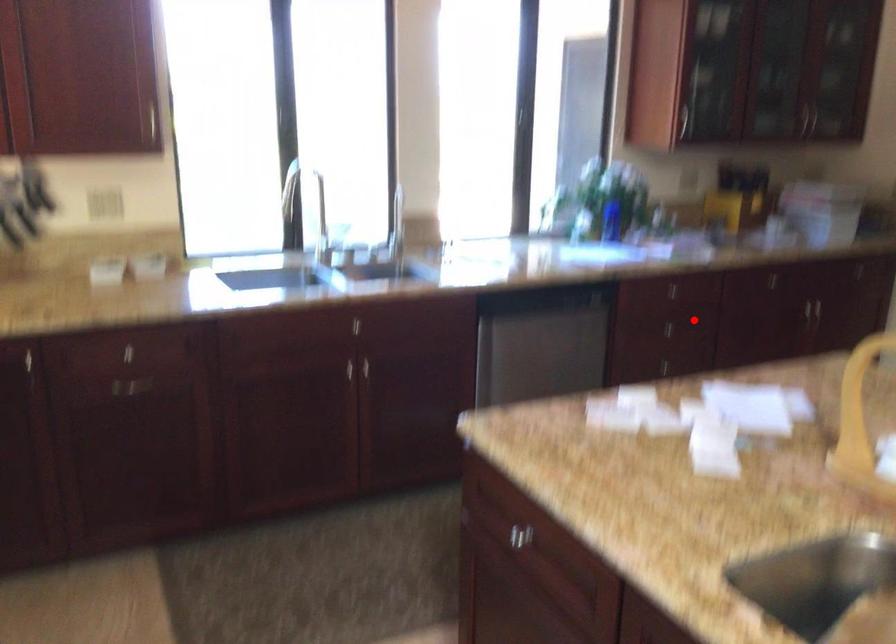
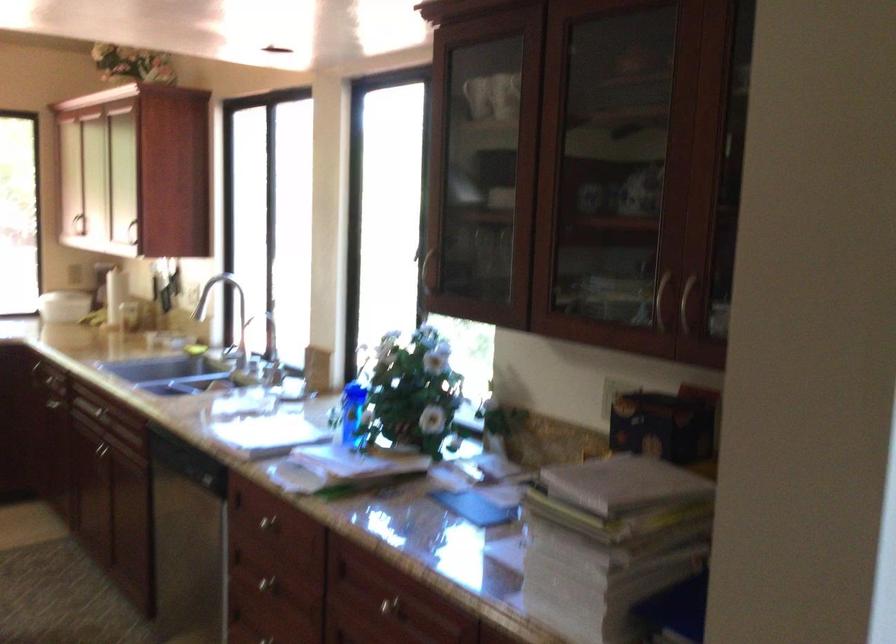
Find the pixel in the second image that matches the highlighted location in the first image.

(266, 583)